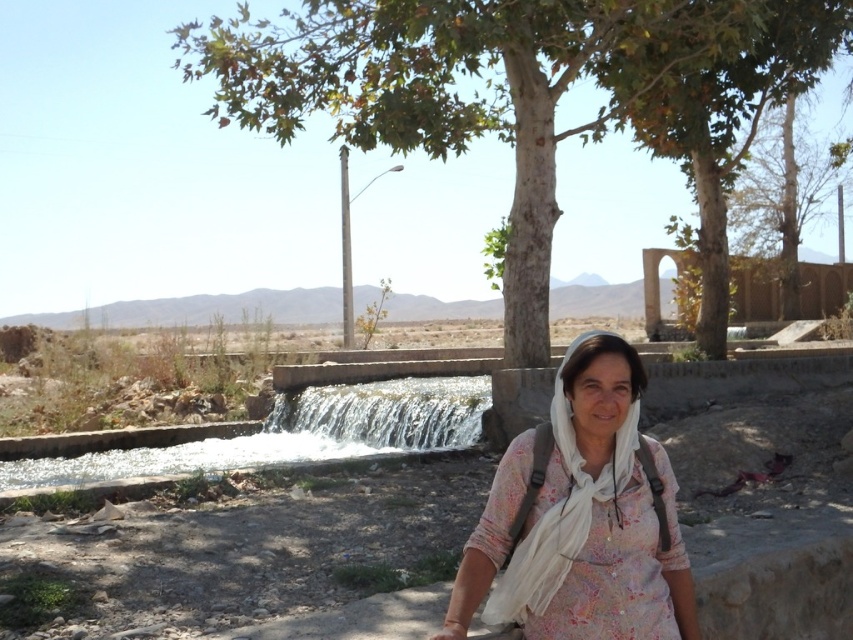
Question: Can you confirm if white floral shirt at center is positioned above clear water cascade at center?

Choices:
 (A) yes
 (B) no

Answer: (A)

Question: Considering the real-world distances, which object is farthest from the green leafy tree at center?

Choices:
 (A) white floral shirt at center
 (B) clear water cascade at center

Answer: (B)

Question: Which point is closer to the camera taking this photo?

Choices:
 (A) (352, 419)
 (B) (527, 524)

Answer: (B)

Question: Which point is closer to the camera?

Choices:
 (A) (425, 401)
 (B) (743, 136)

Answer: (A)

Question: Is green leafy tree at center positioned in front of white floral shirt at center?

Choices:
 (A) yes
 (B) no

Answer: (B)

Question: Does white floral shirt at center appear on the left side of clear water cascade at center?

Choices:
 (A) yes
 (B) no

Answer: (B)